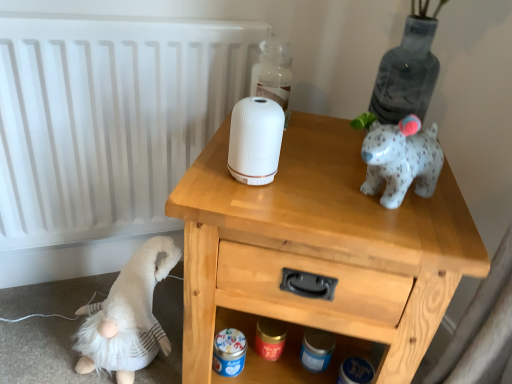
Describe the element at coordinates (127, 316) in the screenshot. I see `white fluffy gnome at lower left` at that location.

Locate an element on the screen. The width and height of the screenshot is (512, 384). wooden nightstand at upper center is located at coordinates (317, 253).

This screenshot has height=384, width=512. What are the coordinates of `white matte radiator at upper left` in the screenshot? It's located at (109, 119).

Is white matte radiator at upper left aimed at white fluffy gnome at lower left?

Yes, white matte radiator at upper left is aimed at white fluffy gnome at lower left.

Considering the positions of objects white matte radiator at upper left and white fluffy gnome at lower left in the image provided, who is in front, white matte radiator at upper left or white fluffy gnome at lower left?

white matte radiator at upper left.

Which is less distant, (73, 86) or (141, 286)?

Point (73, 86).

Based on the photo, is white matte radiator at upper left situated inside white fluffy gnome at lower left or outside?

white matte radiator at upper left is not enclosed by white fluffy gnome at lower left.

Does point (136, 309) come behind point (274, 166)?

Yes, point (136, 309) is farther from viewer.

Relative to white matte speaker at center, is white fluffy gnome at lower left in front or behind?

white fluffy gnome at lower left is behind white matte speaker at center.

Is white fluffy gnome at lower left placed right next to white matte speaker at center?

No, white fluffy gnome at lower left is not with white matte speaker at center.

Does white fluffy gnome at lower left turn towards white matte speaker at center?

No, white fluffy gnome at lower left is not turned towards white matte speaker at center.

Is white fluffy gnome at lower left outside of transparent glass bottle at upper center?

Yes, white fluffy gnome at lower left is located beyond the bounds of transparent glass bottle at upper center.

How distant is white fluffy gnome at lower left from transparent glass bottle at upper center?

white fluffy gnome at lower left is 57.98 centimeters away from transparent glass bottle at upper center.

The height and width of the screenshot is (384, 512). I want to click on toy located in front of the transparent glass bottle at upper center, so click(127, 316).

Is white matte speaker at center surrounding white matte radiator at upper left?

No, white matte radiator at upper left is located outside of white matte speaker at center.

Can you confirm if white matte speaker at center is positioned to the left of white matte radiator at upper left?

No, white matte speaker at center is not to the left of white matte radiator at upper left.

Would you consider white matte speaker at center to be distant from white matte radiator at upper left?

No, white matte speaker at center is in close proximity to white matte radiator at upper left.

What's the angular difference between white matte speaker at center and white matte radiator at upper left's facing directions?

white matte speaker at center and white matte radiator at upper left are facing 31.5 degrees away from each other.

Is transparent glass bottle at upper center spatially inside white matte radiator at upper left, or outside of it?

transparent glass bottle at upper center is outside white matte radiator at upper left.

Could you tell me if transparent glass bottle at upper center is facing white matte radiator at upper left?

No, transparent glass bottle at upper center is not aimed at white matte radiator at upper left.

How many degrees apart are the facing directions of transparent glass bottle at upper center and white matte radiator at upper left?

They differ by 26.5 degrees in their facing directions.

Which object is wider, transparent glass bottle at upper center or white matte radiator at upper left?

With larger width is transparent glass bottle at upper center.

Which object is further away from the camera taking this photo, white matte speaker at center or wooden nightstand at upper center?

white matte speaker at center is further from the camera.

Does white matte speaker at center have a greater height compared to wooden nightstand at upper center?

No, white matte speaker at center is not taller than wooden nightstand at upper center.

In the scene shown: Who is bigger, white matte speaker at center or wooden nightstand at upper center?

wooden nightstand at upper center.

From the image's perspective, is white matte speaker at center below wooden nightstand at upper center?

No.

Does wooden nightstand at upper center touch transparent glass bottle at upper center?

No, wooden nightstand at upper center is not with transparent glass bottle at upper center.

Which object is positioned more to the left, wooden nightstand at upper center or transparent glass bottle at upper center?

From the viewer's perspective, transparent glass bottle at upper center appears more on the left side.

From a real-world perspective, is wooden nightstand at upper center physically above transparent glass bottle at upper center?

Actually, wooden nightstand at upper center is physically below transparent glass bottle at upper center in the real world.

Could you tell me if wooden nightstand at upper center is facing transparent glass bottle at upper center?

No, wooden nightstand at upper center is not turned towards transparent glass bottle at upper center.

Identify the location of radiator on the left of white fluffy gnome at lower left. (109, 119).

Locate an element on the screen. toy behind the white matte speaker at center is located at coordinates (127, 316).

Considering their positions, is wooden nightstand at upper center positioned further to white matte speaker at center than transparent glass bottle at upper center?

transparent glass bottle at upper center.

Based on the photo, estimate the real-world distances between objects in this image. Which object is further from wooden nightstand at upper center, white matte radiator at upper left or transparent glass bottle at upper center?

white matte radiator at upper left is positioned further to the anchor wooden nightstand at upper center.

From the image, which object appears to be nearer to white matte radiator at upper left, transparent glass bottle at upper center or white fluffy gnome at lower left?

Among the two, white fluffy gnome at lower left is located nearer to white matte radiator at upper left.

When comparing their distances from wooden nightstand at upper center, does white matte speaker at center or white matte radiator at upper left seem further?

Among the two, white matte radiator at upper left is located further to wooden nightstand at upper center.

In the scene shown: When comparing their distances from transparent glass bottle at upper center, does white fluffy gnome at lower left or white matte speaker at center seem further?

Among the two, white fluffy gnome at lower left is located further to transparent glass bottle at upper center.

When comparing their distances from wooden nightstand at upper center, does white matte speaker at center or white fluffy gnome at lower left seem further?

The object further to wooden nightstand at upper center is white fluffy gnome at lower left.

From the image, which object appears to be farther from transparent glass bottle at upper center, white fluffy gnome at lower left or white matte radiator at upper left?

white fluffy gnome at lower left is positioned further to the anchor transparent glass bottle at upper center.

Estimate the real-world distances between objects in this image. Which object is further from transparent glass bottle at upper center, white matte speaker at center or white matte radiator at upper left?

Based on the image, white matte radiator at upper left appears to be further to transparent glass bottle at upper center.

Where is `toilet paper between white matte radiator at upper left and transparent glass bottle at upper center in the horizontal direction`? toilet paper between white matte radiator at upper left and transparent glass bottle at upper center in the horizontal direction is located at coordinates (255, 140).

Find the location of a particular element. toilet paper between transparent glass bottle at upper center and wooden nightstand at upper center in the vertical direction is located at coordinates (255, 140).

At what (x,y) coordinates should I click in order to perform the action: click on toilet paper located between white matte radiator at upper left and wooden nightstand at upper center in the left-right direction. Please return your answer as a coordinate pair (x, y). Looking at the image, I should click on (255, 140).

Where is `toilet paper between transparent glass bottle at upper center and white fluffy gnome at lower left from top to bottom`? Image resolution: width=512 pixels, height=384 pixels. toilet paper between transparent glass bottle at upper center and white fluffy gnome at lower left from top to bottom is located at coordinates (255, 140).